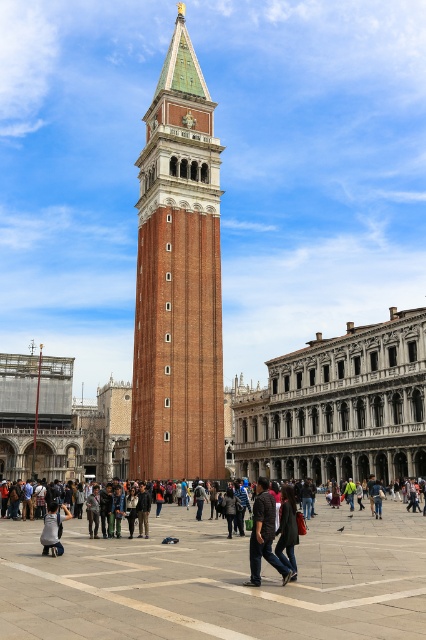
Who is positioned more to the right, dark brown leather jacket at center or gray fabric jacket at center?

From the viewer's perspective, dark brown leather jacket at center appears more on the right side.

Between dark brown leather jacket at center and gray fabric jacket at center, which one has more height?

dark brown leather jacket at center

Is point (265, 520) positioned in front of point (46, 531)?

Yes, point (265, 520) is closer to viewer.

Image resolution: width=426 pixels, height=640 pixels. I want to click on dark brown leather jacket at center, so click(264, 534).

Between point (149, 600) and point (58, 515), which one is positioned in front?

Positioned in front is point (149, 600).

Between concrete paving at center and gray fabric jacket at center, which one appears on the left side from the viewer's perspective?

gray fabric jacket at center

Is point (216, 609) positioned after point (66, 516)?

That is False.

In order to click on concrete paving at center in this screenshot , I will do `click(216, 580)`.

Describe the element at coordinates (178, 280) in the screenshot. The width and height of the screenshot is (426, 640). I see `brown brick tower at center` at that location.

Which of these two, brown brick tower at center or dark gray fabric coat at center, stands taller?

Standing taller between the two is brown brick tower at center.

Which is in front, point (172, 60) or point (287, 554)?

Positioned in front is point (287, 554).

What are the coordinates of `brown brick tower at center` in the screenshot? It's located at (178, 280).